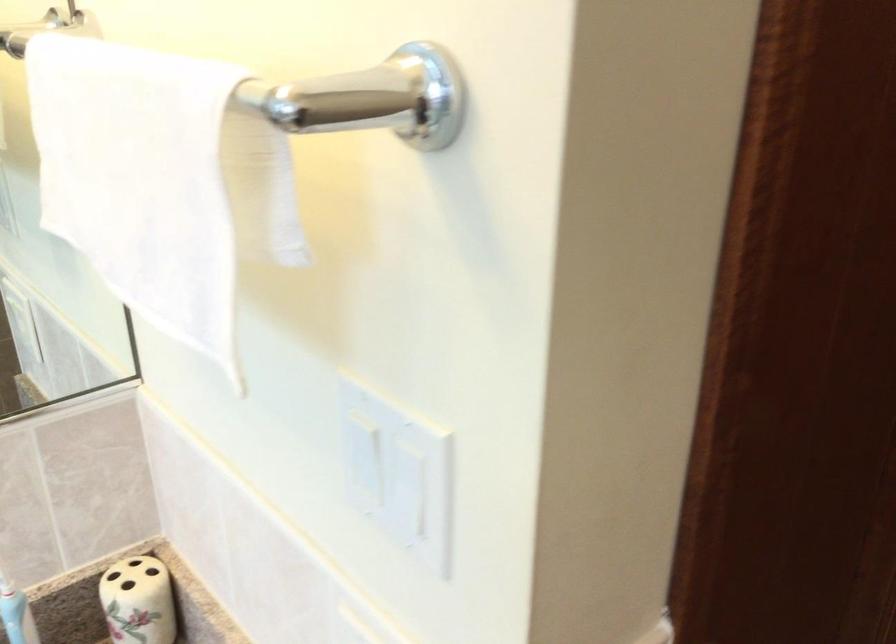
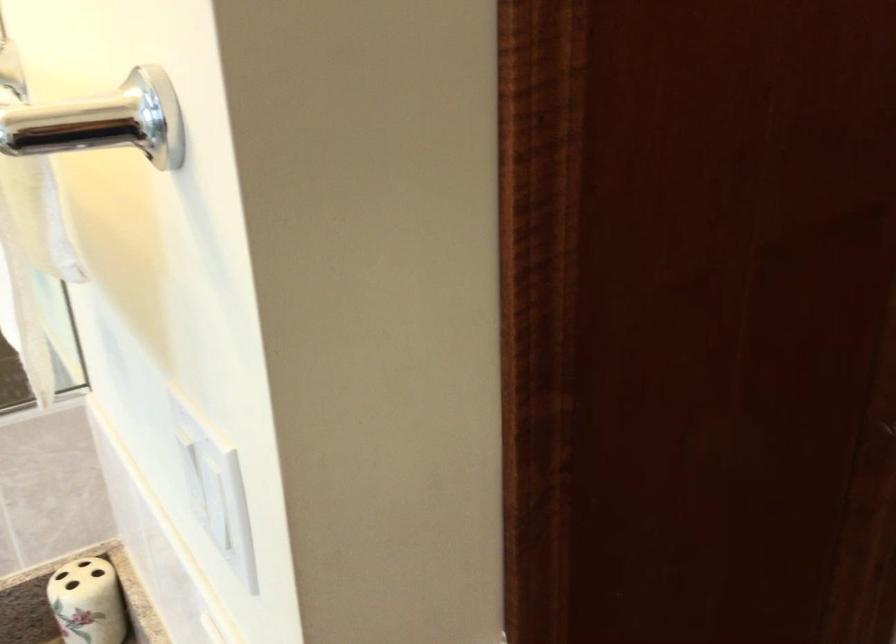
Question: Based on the continuous images, in which direction is the camera rotating? Reply with the corresponding letter.

Choices:
 (A) Left
 (B) Right
 (C) Up
 (D) Down

Answer: (A)